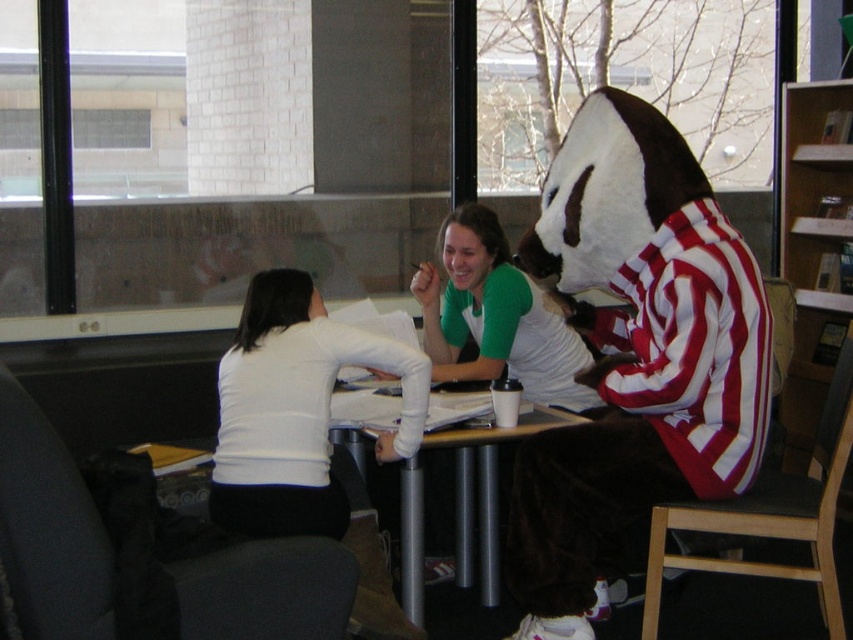
Question: Does green matte shirt at center appear under wooden bookshelf at upper right?

Choices:
 (A) yes
 (B) no

Answer: (A)

Question: Is white matte shirt at center positioned at the back of black fabric chair at left?

Choices:
 (A) yes
 (B) no

Answer: (A)

Question: In this image, where is green matte shirt at center located relative to wooden bookshelf at upper right?

Choices:
 (A) right
 (B) left

Answer: (B)

Question: Which object is closer to the camera taking this photo?

Choices:
 (A) black fabric chair at left
 (B) black fabric chair at lower right

Answer: (A)

Question: Which point is farther from the camera taking this photo?

Choices:
 (A) (44, 572)
 (B) (813, 243)

Answer: (B)

Question: Which point appears closest to the camera in this image?

Choices:
 (A) (381, 381)
 (B) (793, 253)

Answer: (A)